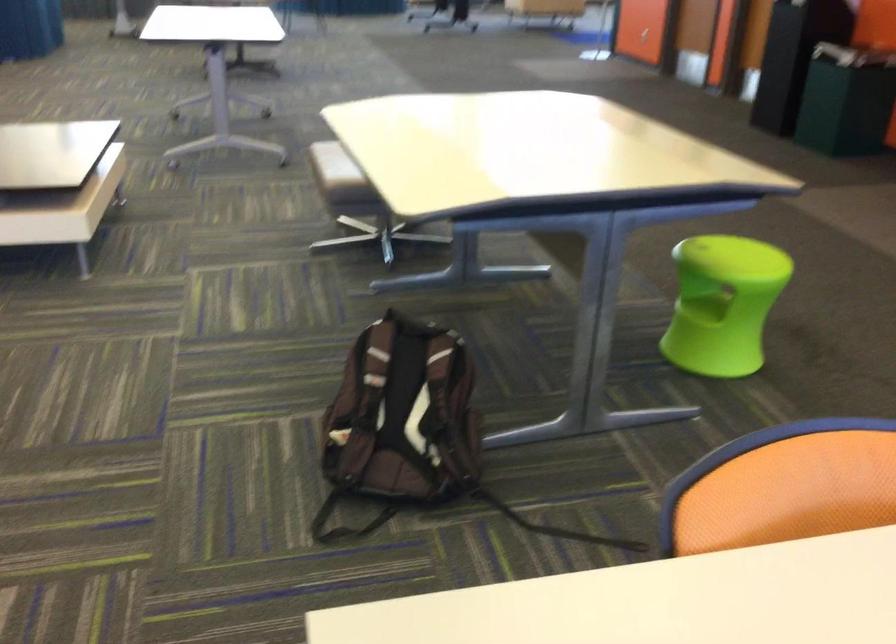
The image size is (896, 644). What are the coordinates of `green stool sitting surface` in the screenshot? It's located at 730,247.